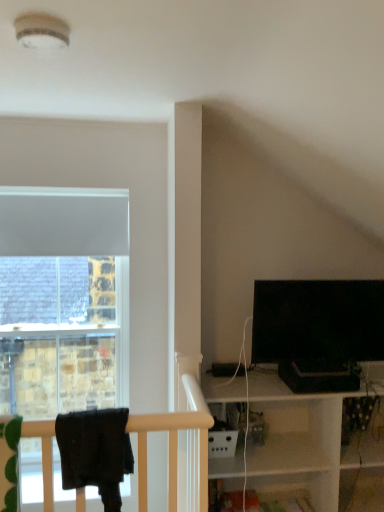
Question: Considering the relative sizes of black glossy tv at right and black fabric at left in the image provided, is black glossy tv at right thinner than black fabric at left?

Choices:
 (A) yes
 (B) no

Answer: (A)

Question: Is black glossy tv at right positioned in front of black fabric at left?

Choices:
 (A) no
 (B) yes

Answer: (A)

Question: Does black glossy tv at right have a lesser height compared to black fabric at left?

Choices:
 (A) yes
 (B) no

Answer: (B)

Question: Is there a large distance between black glossy tv at right and black fabric at left?

Choices:
 (A) yes
 (B) no

Answer: (A)

Question: Is black glossy tv at right located outside black fabric at left?

Choices:
 (A) no
 (B) yes

Answer: (B)

Question: From a real-world perspective, is black glossy tv at right physically above black fabric at left?

Choices:
 (A) no
 (B) yes

Answer: (B)

Question: Would you say black fabric at left contains black glossy tv at right?

Choices:
 (A) no
 (B) yes

Answer: (A)

Question: Can you confirm if black fabric at left is taller than black glossy tv at right?

Choices:
 (A) no
 (B) yes

Answer: (A)

Question: Is black fabric at left far from black glossy tv at right?

Choices:
 (A) yes
 (B) no

Answer: (A)

Question: Can you confirm if black fabric at left is wider than black glossy tv at right?

Choices:
 (A) no
 (B) yes

Answer: (B)

Question: Is black fabric at left oriented away from black glossy tv at right?

Choices:
 (A) yes
 (B) no

Answer: (B)

Question: Can you confirm if black fabric at left is positioned to the right of black glossy tv at right?

Choices:
 (A) no
 (B) yes

Answer: (A)

Question: Is point (283, 352) positioned closer to the camera than point (125, 418)?

Choices:
 (A) closer
 (B) farther

Answer: (B)